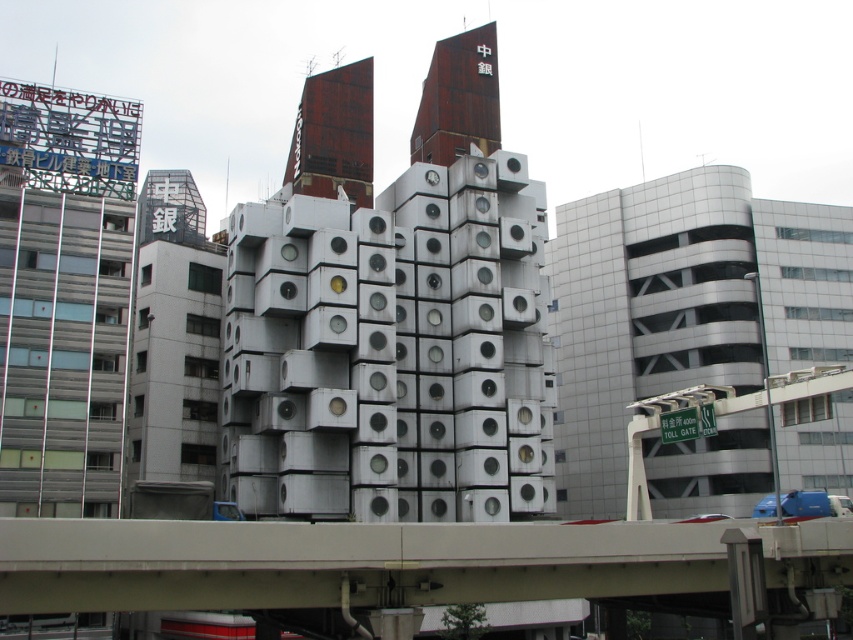
Question: Estimate the real-world distances between objects in this image. Which object is closer to the rustic wood tower at upper center?

Choices:
 (A) white textured parking garage at right
 (B) concrete bridge at center

Answer: (B)

Question: Can you confirm if rustic wood tower at upper center is thinner than rusty metal tower at upper center?

Choices:
 (A) no
 (B) yes

Answer: (A)

Question: Is white textured parking garage at right to the left of concrete bridge at center from the viewer's perspective?

Choices:
 (A) no
 (B) yes

Answer: (A)

Question: Which point appears closest to the camera in this image?

Choices:
 (A) (315, 138)
 (B) (666, 179)

Answer: (A)

Question: Which point appears farthest from the camera in this image?

Choices:
 (A) (170, 579)
 (B) (354, 67)
 (C) (480, 100)
 (D) (775, 268)

Answer: (D)

Question: Is concrete bridge at center thinner than rusty metal tower at upper center?

Choices:
 (A) yes
 (B) no

Answer: (B)